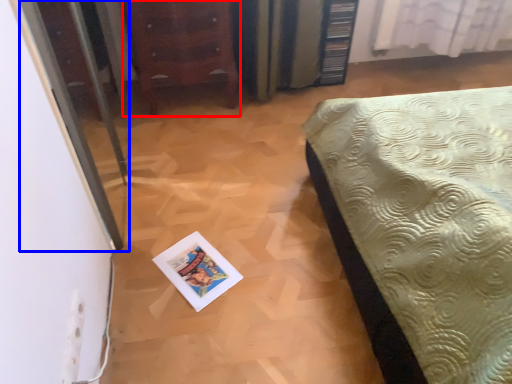
Question: Which of the following is the farthest to the observer, furniture (highlighted by a red box) or screen door (highlighted by a blue box)?

Choices:
 (A) furniture
 (B) screen door

Answer: (A)